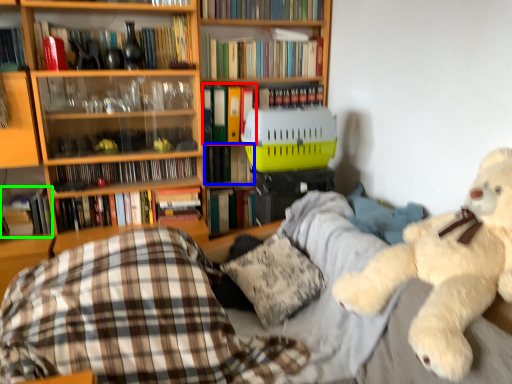
Question: Estimate the real-world distances between objects in this image. Which object is closer to book (highlighted by a red box), book (highlighted by a blue box) or book (highlighted by a green box)?

Choices:
 (A) book
 (B) book

Answer: (A)